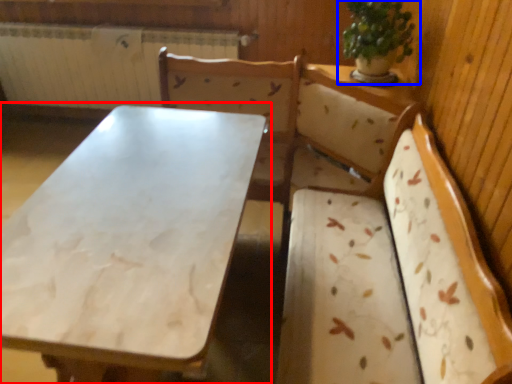
Question: Which point is further to the camera, table (highlighted by a red box) or houseplant (highlighted by a blue box)?

Choices:
 (A) table
 (B) houseplant

Answer: (B)